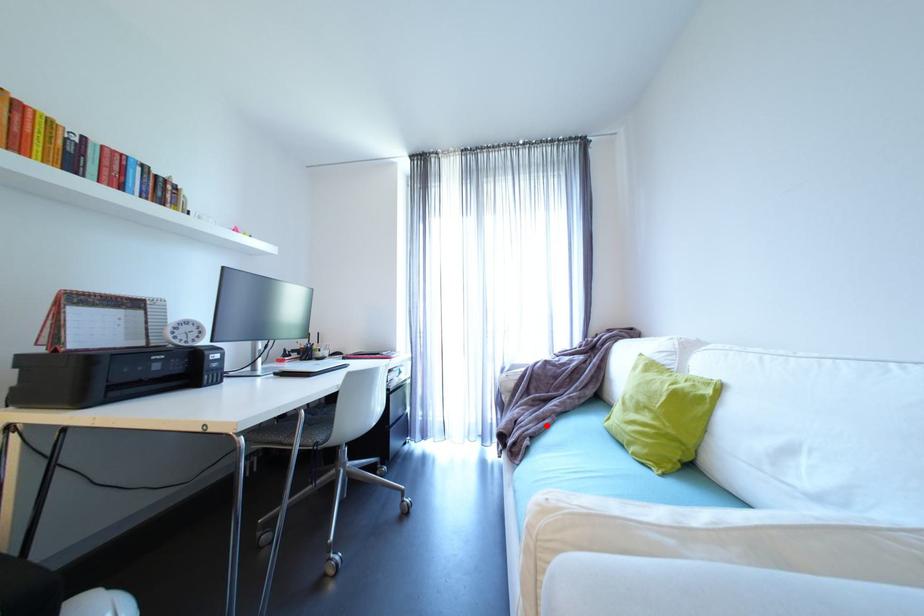
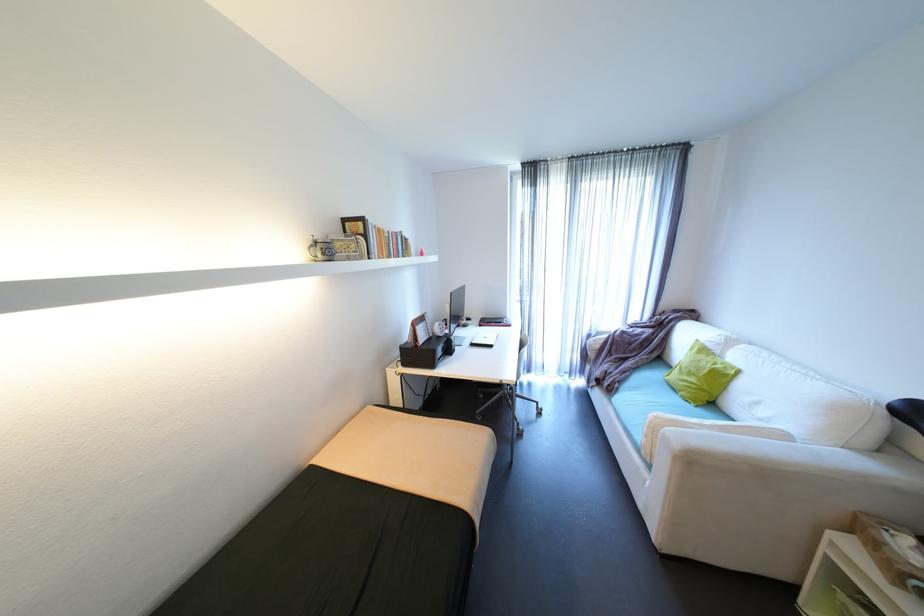
Find the pixel in the second image that matches the highlighted location in the first image.

(630, 377)